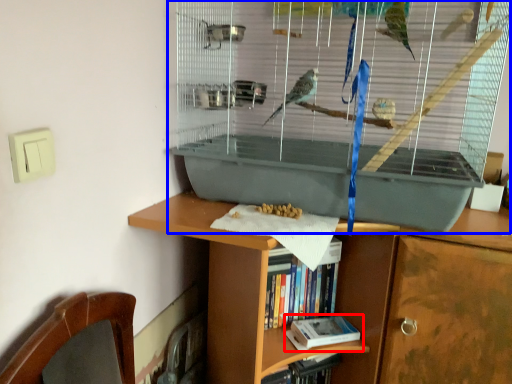
Question: Which point is closer to the camera, book (highlighted by a red box) or bird cage (highlighted by a blue box)?

Choices:
 (A) book
 (B) bird cage

Answer: (B)